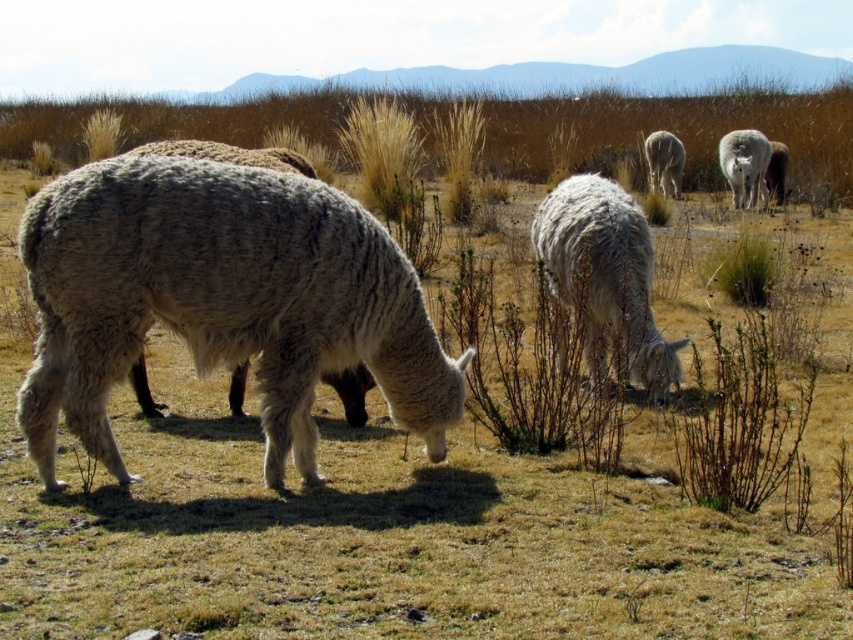
You are standing at the center of the field and want to locate the white woolen alpaca at left. Which direction should you look to find it?

You should look to the left to find the white woolen alpaca at left, as it is positioned at point [221,301] in the image.

Looking at this image, you are a farmer checking the field. You notice the white woolen alpaca at left and the white woolen sheep at center. Which animal is taller?

The white woolen alpaca at left is taller than the white woolen sheep at center.